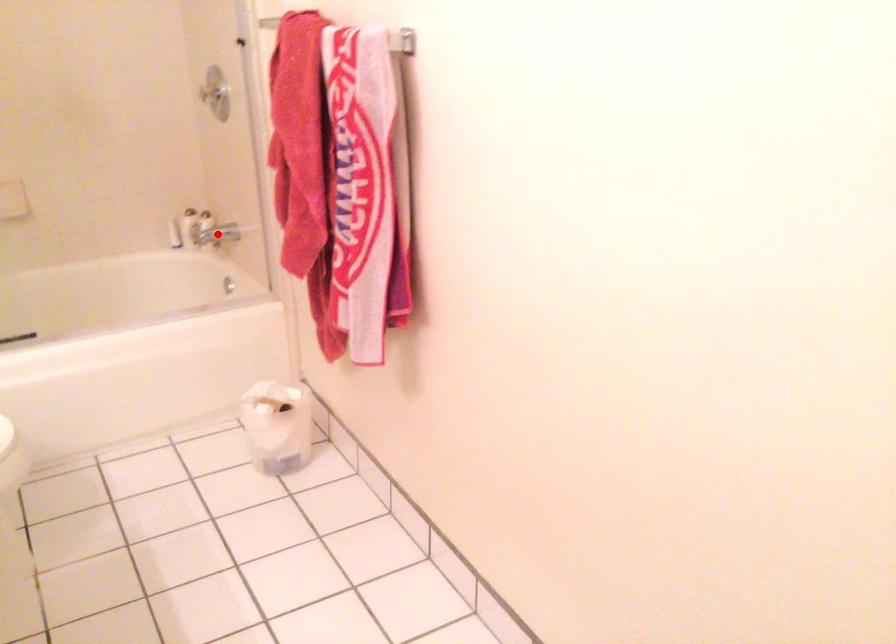
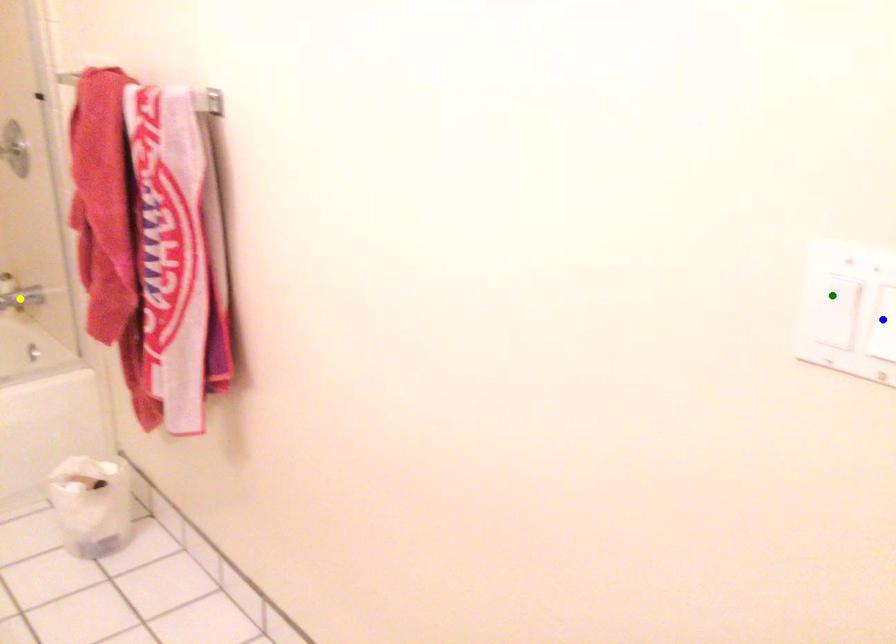
Question: I am providing you with two images of the same scene from different viewpoints. A red point is marked on the first image. You are given multiple points on the second image. Which mark in image 2 goes with the point in image 1?

Choices:
 (A) yellow point
 (B) green point
 (C) blue point

Answer: (A)